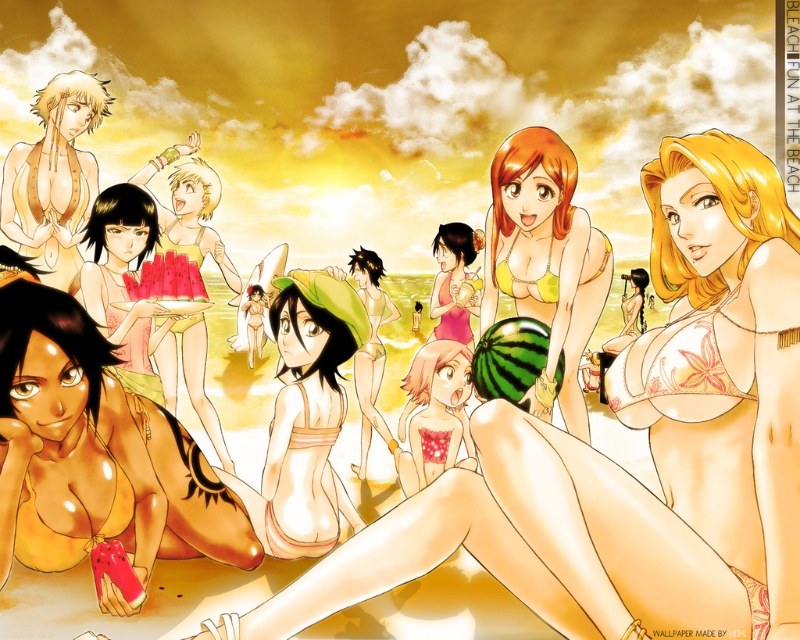
You are a photographer trying to capture a closeup of the matte yellow bikini at center and the matte green bikini at center. Since you want to focus on one of them, which bikini should you choose to ensure it appears bigger in your photo?

The matte yellow bikini at center is larger in size than the matte green bikini at center, so you should choose the matte yellow bikini at center to ensure it appears bigger in your photo.

You are a photographer trying to capture the perfect shot of the beach scene. You notice a point at coordinates (x=306, y=417). What object is located at this point?

The point at coordinates (x=306, y=417) corresponds to the matte orange bikini at center.

You are a photographer trying to capture the perfect shot of the matte yellow bikini at center and the matte green bikini at center. Which one is closer to the camera based on their positions?

The matte yellow bikini at center is positioned under the matte green bikini at center, so it is closer to the camera.